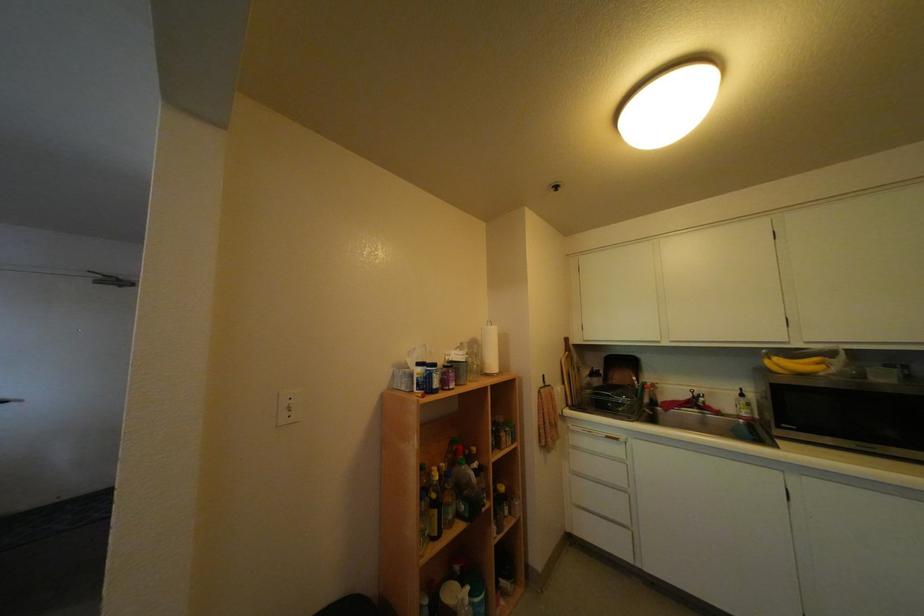
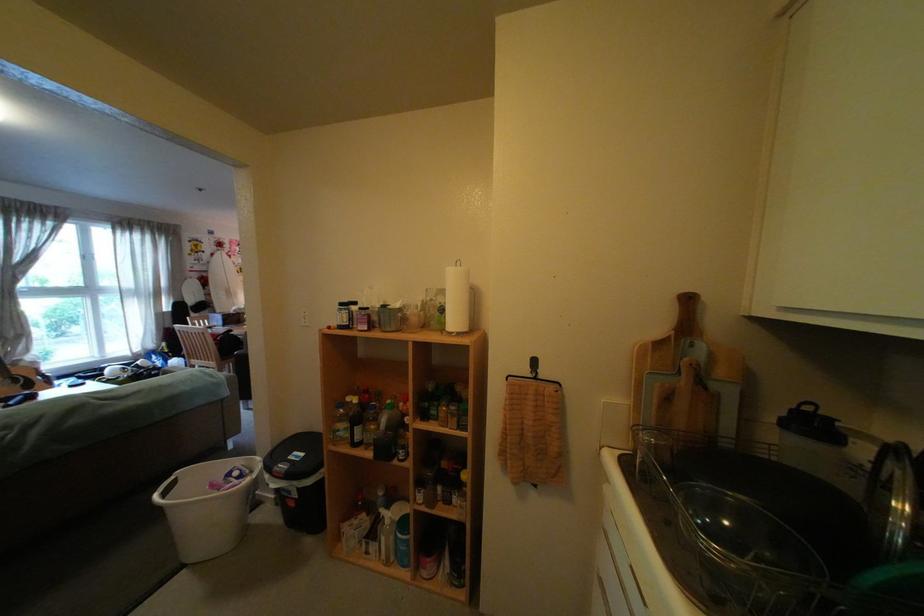
Locate, in the second image, the point that corresponds to (590,365) in the first image.

(704, 367)